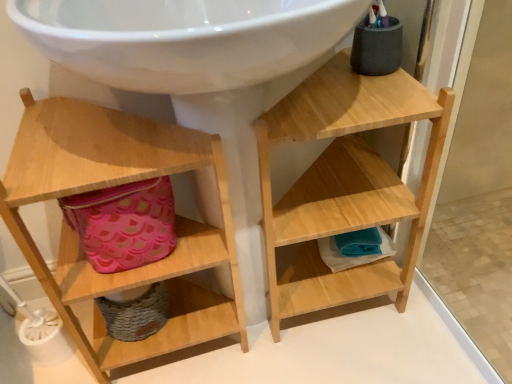
Question: Looking at their shapes, would you say wooden shelf at left, which is counted as the 2th shelf, starting from the right, is wider or thinner than natural wood shelf at upper right, the 2th shelf from the left?

Choices:
 (A) wide
 (B) thin

Answer: (B)

Question: From the image's perspective, is wooden shelf at left, which is counted as the 2th shelf, starting from the right, located above or below natural wood shelf at upper right, the 2th shelf from the left?

Choices:
 (A) below
 (B) above

Answer: (A)

Question: Estimate the real-world distances between objects in this image. Which object is closer to the pink fabric basket at lower left?

Choices:
 (A) wooden shelf at left, which is counted as the 2th shelf, starting from the right
 (B) natural wood shelf at upper right, the 1th shelf when ordered from right to left

Answer: (A)

Question: Considering the real-world distances, which object is closest to the natural wood shelf at upper right, the 1th shelf when ordered from right to left?

Choices:
 (A) pink fabric basket at lower left
 (B) wooden shelf at left, which is counted as the 2th shelf, starting from the right

Answer: (B)